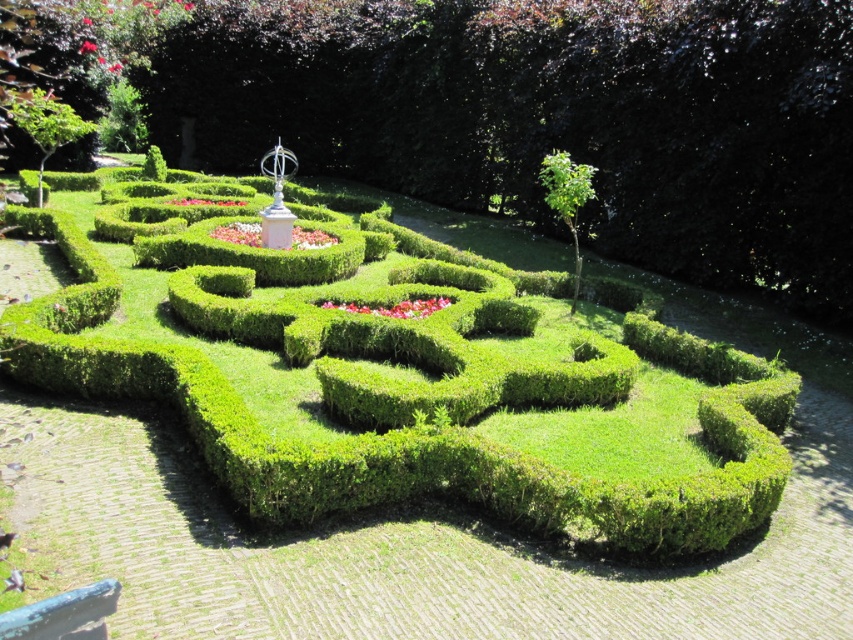
Question: Which of the following is the farthest from the observer?

Choices:
 (A) (233, 481)
 (B) (555, 157)

Answer: (B)

Question: Is the position of green hedge maze at center more distant than that of green leafy bush at upper right?

Choices:
 (A) no
 (B) yes

Answer: (A)

Question: Is green hedge maze at center bigger than green leafy bush at upper right?

Choices:
 (A) yes
 (B) no

Answer: (A)

Question: Is green hedge maze at center positioned before green leafy bush at upper right?

Choices:
 (A) no
 (B) yes

Answer: (B)

Question: Which of the following is the farthest from the observer?

Choices:
 (A) green leafy bush at upper right
 (B) green hedge maze at center

Answer: (A)

Question: Which point is closer to the camera?

Choices:
 (A) green hedge maze at center
 (B) green leafy bush at upper right

Answer: (A)